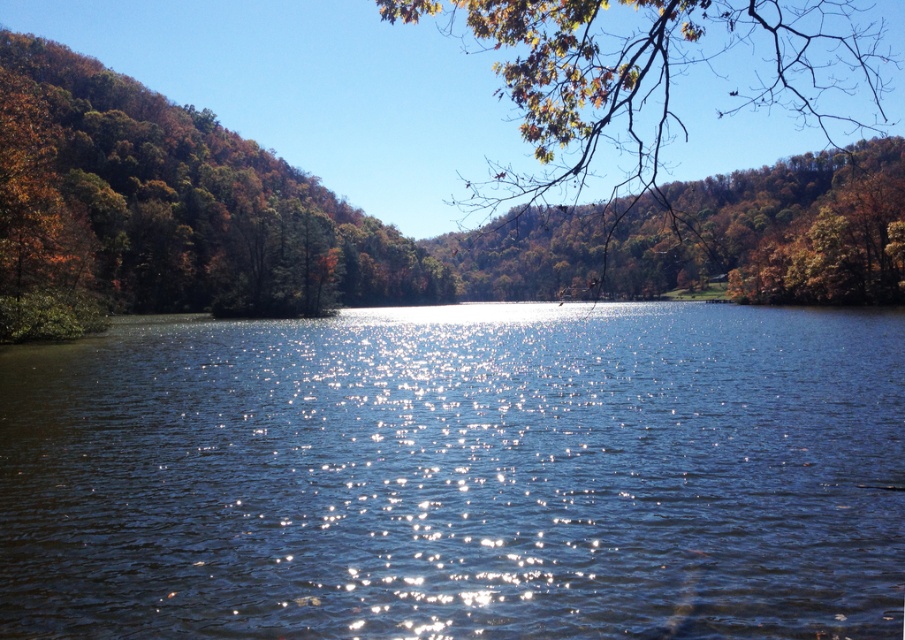
Question: Where is blue liquid water at center located in relation to brown leafy branch at upper right in the image?

Choices:
 (A) left
 (B) right

Answer: (A)

Question: Which point appears closest to the camera in this image?

Choices:
 (A) (196, 358)
 (B) (556, 86)

Answer: (B)

Question: From the image, what is the correct spatial relationship of blue liquid water at center in relation to brown leafy branch at upper right?

Choices:
 (A) left
 (B) right

Answer: (A)

Question: Can you confirm if blue liquid water at center is smaller than brown leafy branch at upper right?

Choices:
 (A) yes
 (B) no

Answer: (A)